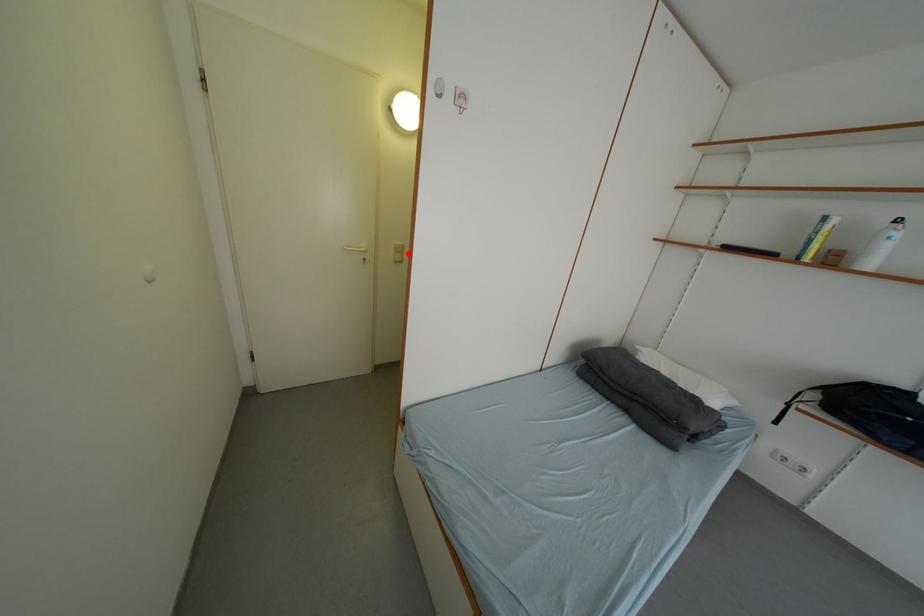
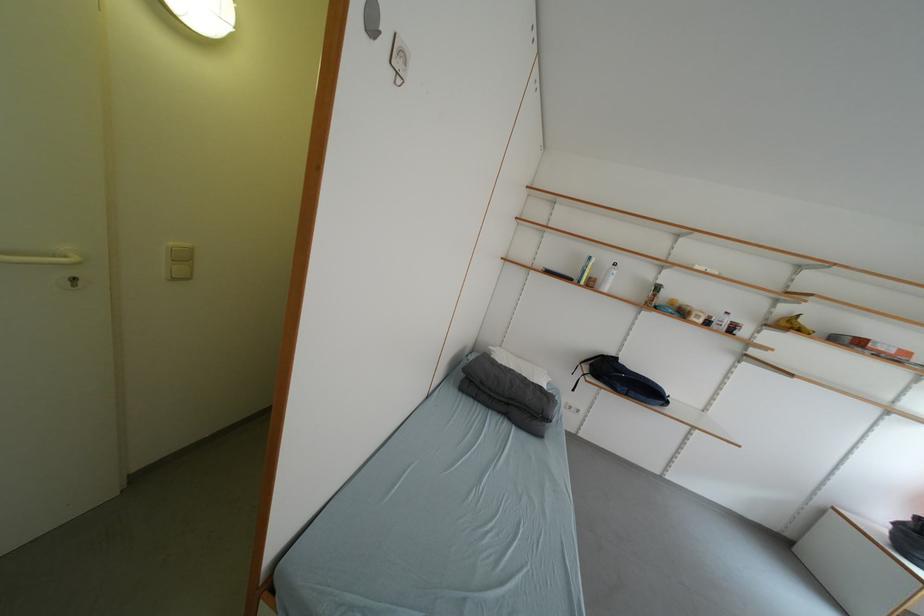
Find the pixel in the second image that matches the highlighted location in the first image.

(191, 261)